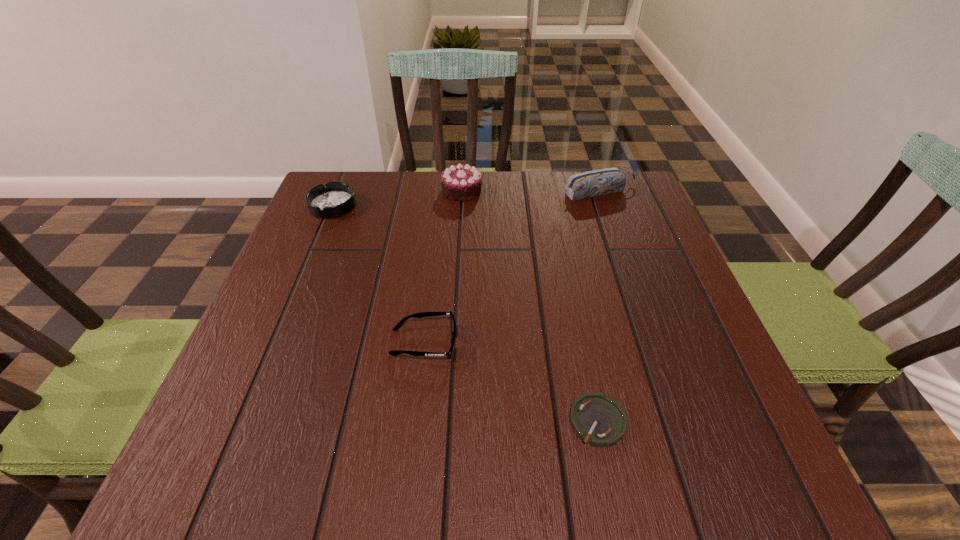
Identify the location of vacant space positioned on the front-facing side of the fourth farthest object. Image resolution: width=960 pixels, height=540 pixels. pos(577,342).

Where is `vacant region located on the back of the right ashtray`? vacant region located on the back of the right ashtray is located at coordinates (587, 367).

Identify the location of chocolate cake that is at the far edge. (461, 182).

Where is `pencil box at the far edge`? pencil box at the far edge is located at coordinates (599, 182).

I want to click on ashtray present at the far edge, so point(335,199).

Find the location of a particular element. The image size is (960, 540). object located in the near edge section of the desktop is located at coordinates (598, 420).

The height and width of the screenshot is (540, 960). Identify the location of object that is positioned at the left edge. (335, 199).

Where is `object positioned at the right edge`? The height and width of the screenshot is (540, 960). object positioned at the right edge is located at coordinates tap(599, 182).

At what (x,y) coordinates should I click in order to perform the action: click on object located at the far left corner. Please return your answer as a coordinate pair (x, y). The width and height of the screenshot is (960, 540). Looking at the image, I should click on (335, 199).

Where is `object that is at the far right corner`? Image resolution: width=960 pixels, height=540 pixels. object that is at the far right corner is located at coordinates (599, 182).